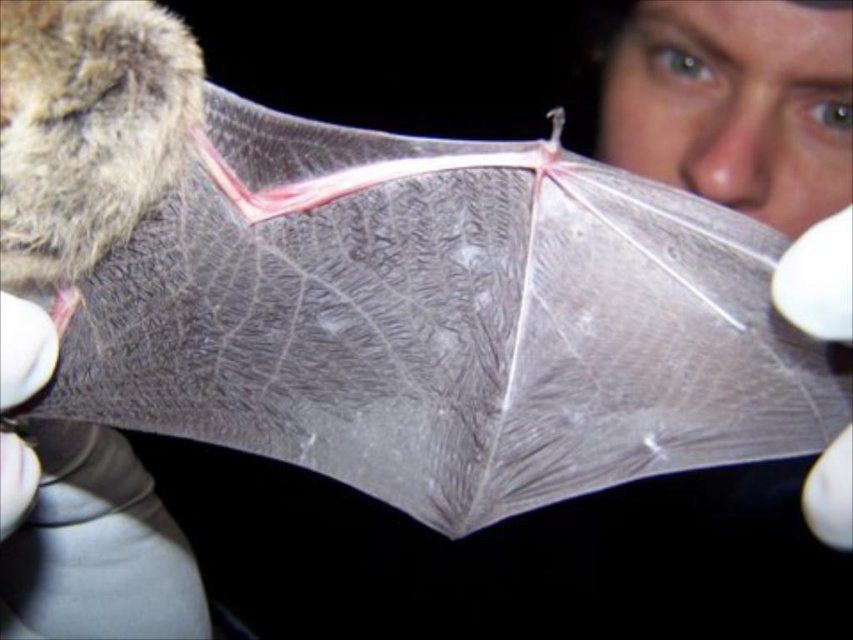
You are a researcher examining the bat wing. You need to compare the size of the white matte glove at right and the smooth skin nose at center. Which one is wider?

The white matte glove at right is less wide than the smooth skin nose at center, so the smooth skin nose at center is wider.

You are a researcher examining the bat wing. You notice the smooth skin nose at center and the white matte glove at lower left. Which object is bigger in size?

The smooth skin nose at center is larger in size than the white matte glove at lower left.

You are a photographer trying to capture a close shot of the bat wing. You notice the smooth skin nose at center and the white matte glove at lower left. Which object is closer to your camera lens?

The smooth skin nose at center is closer to the camera lens because it is further to the viewer than the white matte glove at lower left.